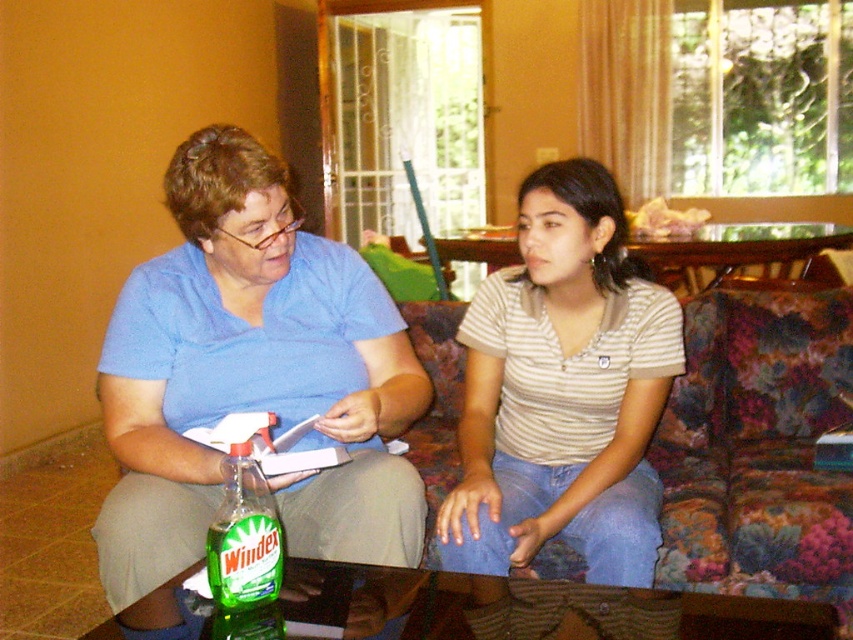
Can you confirm if green matte windex at left is shorter than green glass windex at lower left?

No.

Is point (219, 253) in front of point (276, 592)?

No, it is behind (276, 592).

Where is `green matte windex at left`? green matte windex at left is located at coordinates (248, 381).

Does green matte windex at left appear over striped cotton shirt at center?

Indeed, green matte windex at left is positioned over striped cotton shirt at center.

Between green matte windex at left and striped cotton shirt at center, which one is positioned lower?

striped cotton shirt at center

Is point (270, 480) positioned behind point (636, 314)?

No, it is not.

Image resolution: width=853 pixels, height=640 pixels. Find the location of `green matte windex at left`. green matte windex at left is located at coordinates (248, 381).

Does striped cotton shirt at center appear on the right side of floral fabric couch at center?

Incorrect, striped cotton shirt at center is not on the right side of floral fabric couch at center.

Is striped cotton shirt at center bigger than floral fabric couch at center?

No.

Identify the location of striped cotton shirt at center. The height and width of the screenshot is (640, 853). (563, 390).

Find the location of a particular element. striped cotton shirt at center is located at coordinates (563, 390).